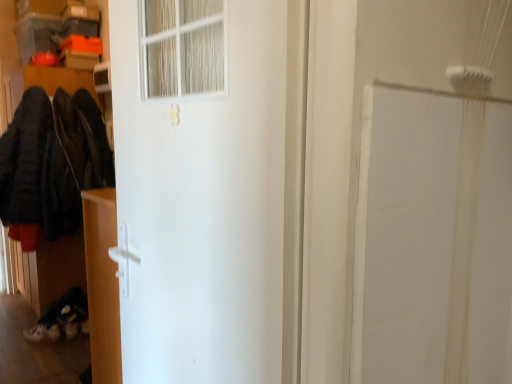
Question: Considering their positions, is white matte door at center located in front of or behind matte white cabinet at lower left?

Choices:
 (A) behind
 (B) front

Answer: (B)

Question: Visually, is white matte door at center positioned to the left or to the right of matte white cabinet at lower left?

Choices:
 (A) right
 (B) left

Answer: (A)

Question: Estimate the real-world distances between objects in this image. Which object is farther from the white matte door at center?

Choices:
 (A) dark woolen coat at left
 (B) matte white cabinet at lower left

Answer: (A)

Question: Which object is positioned closest to the white matte door at center?

Choices:
 (A) dark woolen coat at left
 (B) matte white cabinet at lower left

Answer: (B)